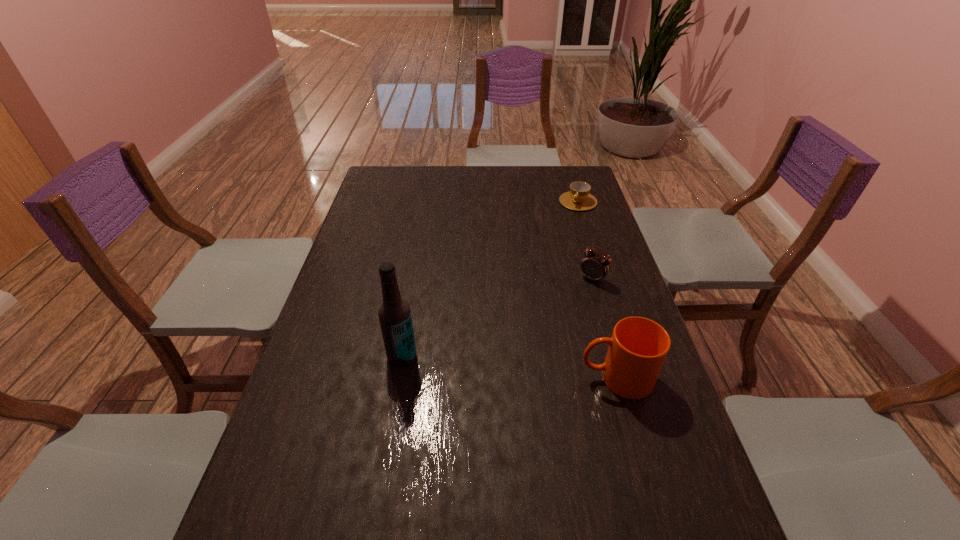
I want to click on cup that is positioned at the right edge, so click(578, 198).

Image resolution: width=960 pixels, height=540 pixels. I want to click on object at the far right corner, so click(578, 198).

Where is `free space at the left edge of the desktop`? The image size is (960, 540). free space at the left edge of the desktop is located at coordinates (359, 265).

Where is `blank space at the right edge of the desktop`? This screenshot has height=540, width=960. blank space at the right edge of the desktop is located at coordinates (626, 317).

Where is `free region at the far left corner of the desktop`? Image resolution: width=960 pixels, height=540 pixels. free region at the far left corner of the desktop is located at coordinates (375, 191).

At what (x,y) coordinates should I click in order to perform the action: click on free space between the cup and the alarm clock. Please return your answer as a coordinate pair (x, y). Looking at the image, I should click on (586, 240).

This screenshot has width=960, height=540. Find the location of `vacant area that lies between the mug and the cup`. vacant area that lies between the mug and the cup is located at coordinates tap(597, 290).

You are a GUI agent. You are given a task and a screenshot of the screen. Output one action in this format:
    pyautogui.click(x=<x>, y=<y>)
    Task: Click on the free space that is in between the second tallest object and the beer bottle
    
    Given the screenshot: What is the action you would take?
    pyautogui.click(x=509, y=367)

At what (x,y) coordinates should I click in order to perform the action: click on empty location between the mug and the alarm clock. Please return your answer as a coordinate pair (x, y). Image resolution: width=960 pixels, height=540 pixels. Looking at the image, I should click on (605, 328).

Identify the location of vacant area between the second farthest object and the mug. This screenshot has height=540, width=960. (605, 328).